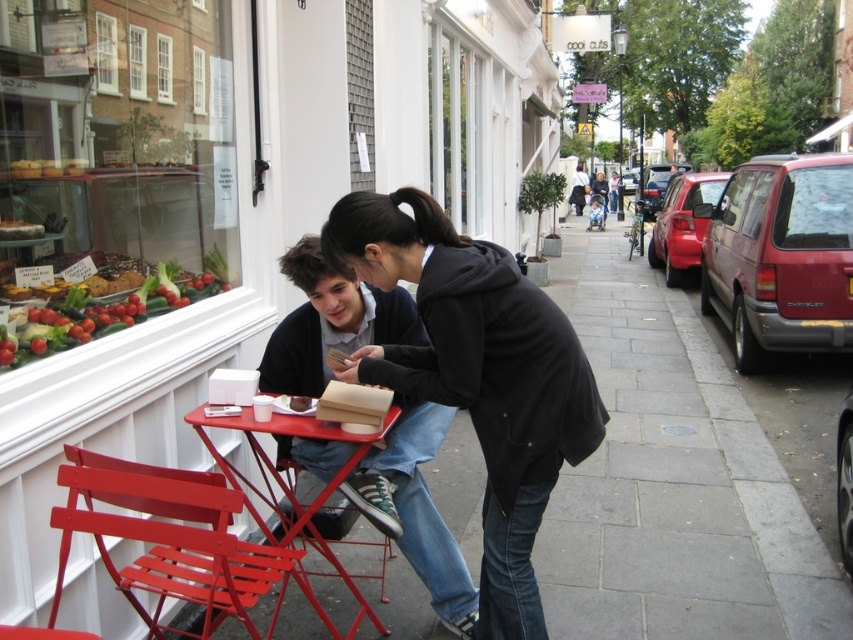
You are a delivery person who needs to place a large package on the table between the metallic red chair at lower left and the metallic red chair at lower center. Which chair should you avoid placing the package near to ensure there is enough space?

You should avoid placing the package near the metallic red chair at lower left because it is larger in size than the metallic red chair at lower center, leaving less space on that side.

You are standing at the point labeled point [239,579] and want to walk to the point labeled point [468,301]. Which direction should you move to reach your destination?

You should move forward because point [468,301] is in front of point [239,579].